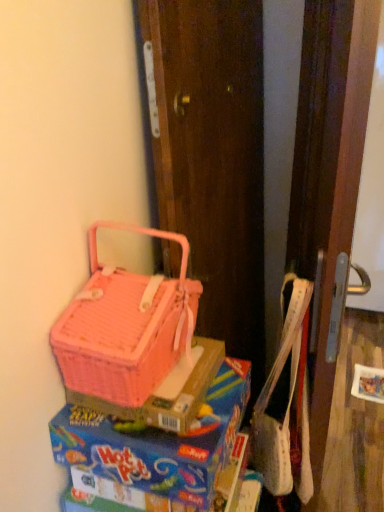
This screenshot has width=384, height=512. Find the location of `pink plastic lunch box at lower left`. pink plastic lunch box at lower left is located at coordinates (159, 443).

What do you see at coordinates (159, 443) in the screenshot?
I see `pink plastic lunch box at lower left` at bounding box center [159, 443].

Where is `wooden screen door at right`? The height and width of the screenshot is (512, 384). wooden screen door at right is located at coordinates (329, 170).

Is wooden screen door at right to the right of pink wicker picnic basket at left from the viewer's perspective?

Yes.

From the image's perspective, is wooden screen door at right positioned above or below pink wicker picnic basket at left?

Clearly, from the image's perspective, wooden screen door at right is above pink wicker picnic basket at left.

Find the location of a particular element. picnic basket on the left of wooden screen door at right is located at coordinates (125, 327).

Is wooden screen door at right oriented towards pink wicker picnic basket at left?

No, wooden screen door at right is not turned towards pink wicker picnic basket at left.

From a real-world perspective, is wooden screen door at right physically above pink wicker basket at upper left?

Incorrect, from a real-world perspective, wooden screen door at right is lower than pink wicker basket at upper left.

Considering the relative sizes of wooden screen door at right and pink wicker basket at upper left in the image provided, is wooden screen door at right bigger than pink wicker basket at upper left?

Yes.

You are a GUI agent. You are given a task and a screenshot of the screen. Output one action in this format:
    pyautogui.click(x=<x>, y=<y>)
    Task: Click on the box above the wooden screen door at right (from a real-world perspective)
    This screenshot has width=384, height=512.
    Given the screenshot: What is the action you would take?
    pyautogui.click(x=166, y=400)

Is point (333, 14) closer to camera compared to point (106, 410)?

That is False.

What's the angular difference between pink wicker picnic basket at left and wooden screen door at right's facing directions?

There is a 87.7-degree angle between the facing directions of pink wicker picnic basket at left and wooden screen door at right.

Considering the sizes of objects pink wicker picnic basket at left and wooden screen door at right in the image provided, who is wider, pink wicker picnic basket at left or wooden screen door at right?

With larger width is pink wicker picnic basket at left.

Between pink wicker picnic basket at left and wooden screen door at right, which one appears on the right side from the viewer's perspective?

wooden screen door at right.

In the scene shown: Is pink wicker picnic basket at left facing towards wooden screen door at right?

No, pink wicker picnic basket at left is not oriented towards wooden screen door at right.

Is pink wicker basket at upper left in front of pink wicker picnic basket at left?

No, it is behind pink wicker picnic basket at left.

How different are the orientations of pink wicker basket at upper left and pink wicker picnic basket at left in degrees?

pink wicker basket at upper left and pink wicker picnic basket at left are facing 2.76 degrees away from each other.

Considering the sizes of objects pink wicker basket at upper left and pink wicker picnic basket at left in the image provided, who is wider, pink wicker basket at upper left or pink wicker picnic basket at left?

pink wicker basket at upper left.

Is pink wicker basket at upper left not within pink plastic lunch box at lower left?

pink wicker basket at upper left is positioned outside pink plastic lunch box at lower left.

Is pink wicker basket at upper left wider than pink plastic lunch box at lower left?

No.

Considering the positions of point (120, 415) and point (226, 432), is point (120, 415) closer or farther from the camera than point (226, 432)?

Point (120, 415) is farther from the camera than point (226, 432).

Consider the image. Is pink wicker basket at upper left at the right side of pink plastic lunch box at lower left?

No.

Which object is wider, pink plastic lunch box at lower left or wooden screen door at right?

pink plastic lunch box at lower left is wider.

In the scene shown: How different are the orientations of pink plastic lunch box at lower left and wooden screen door at right in degrees?

There is a 91.7-degree angle between the facing directions of pink plastic lunch box at lower left and wooden screen door at right.

Between pink plastic lunch box at lower left and wooden screen door at right, which one has more height?

wooden screen door at right.

Looking at this image, is pink plastic lunch box at lower left positioned before pink wicker picnic basket at left?

That is False.

Is pink plastic lunch box at lower left far away from pink wicker picnic basket at left?

Actually, pink plastic lunch box at lower left and pink wicker picnic basket at left are a little close together.

Could you tell me if pink plastic lunch box at lower left is facing pink wicker picnic basket at left?

No.

From the image's perspective, does pink plastic lunch box at lower left appear higher than pink wicker picnic basket at left?

No, from the image's perspective, pink plastic lunch box at lower left is not on top of pink wicker picnic basket at left.

Image resolution: width=384 pixels, height=512 pixels. What are the coordinates of `picnic basket that appears below the wooden screen door at right (from the image's perspective)` in the screenshot? It's located at (125, 327).

The image size is (384, 512). What are the coordinates of `screen door located on the right of pink wicker basket at upper left` in the screenshot? It's located at (329, 170).

Based on the photo, when comparing their distances from pink plastic lunch box at lower left, does pink wicker basket at upper left or pink wicker picnic basket at left seem closer?

pink wicker basket at upper left is closer to pink plastic lunch box at lower left.

Estimate the real-world distances between objects in this image. Which object is further from wooden screen door at right, pink wicker picnic basket at left or pink wicker basket at upper left?

pink wicker basket at upper left is further to wooden screen door at right.

Based on their spatial positions, is pink wicker picnic basket at left or pink wicker basket at upper left closer to pink plastic lunch box at lower left?

The object closer to pink plastic lunch box at lower left is pink wicker basket at upper left.

When comparing their distances from pink plastic lunch box at lower left, does pink wicker basket at upper left or wooden screen door at right seem further?

wooden screen door at right.

Estimate the real-world distances between objects in this image. Which object is closer to pink plastic lunch box at lower left, wooden screen door at right or pink wicker basket at upper left?

pink wicker basket at upper left is closer to pink plastic lunch box at lower left.

Based on their spatial positions, is pink wicker basket at upper left or wooden screen door at right closer to pink wicker picnic basket at left?

Based on the image, pink wicker basket at upper left appears to be nearer to pink wicker picnic basket at left.

From the image, which object appears to be farther from pink wicker picnic basket at left, pink plastic lunch box at lower left or pink wicker basket at upper left?

pink plastic lunch box at lower left is positioned further to the anchor pink wicker picnic basket at left.

Estimate the real-world distances between objects in this image. Which object is closer to pink wicker basket at upper left, wooden screen door at right or pink wicker picnic basket at left?

pink wicker picnic basket at left is positioned closer to the anchor pink wicker basket at upper left.

This screenshot has width=384, height=512. What are the coordinates of `lunch box located between pink wicker picnic basket at left and wooden screen door at right in the left-right direction` in the screenshot? It's located at (159, 443).

Find the location of a particular element. The image size is (384, 512). lunch box between pink wicker basket at upper left and wooden screen door at right is located at coordinates (159, 443).

At what (x,y) coordinates should I click in order to perform the action: click on box between pink wicker picnic basket at left and pink plastic lunch box at lower left in the up-down direction. Please return your answer as a coordinate pair (x, y). Image resolution: width=384 pixels, height=512 pixels. Looking at the image, I should click on (166, 400).

The width and height of the screenshot is (384, 512). I want to click on box between pink wicker picnic basket at left and wooden screen door at right from left to right, so click(x=166, y=400).